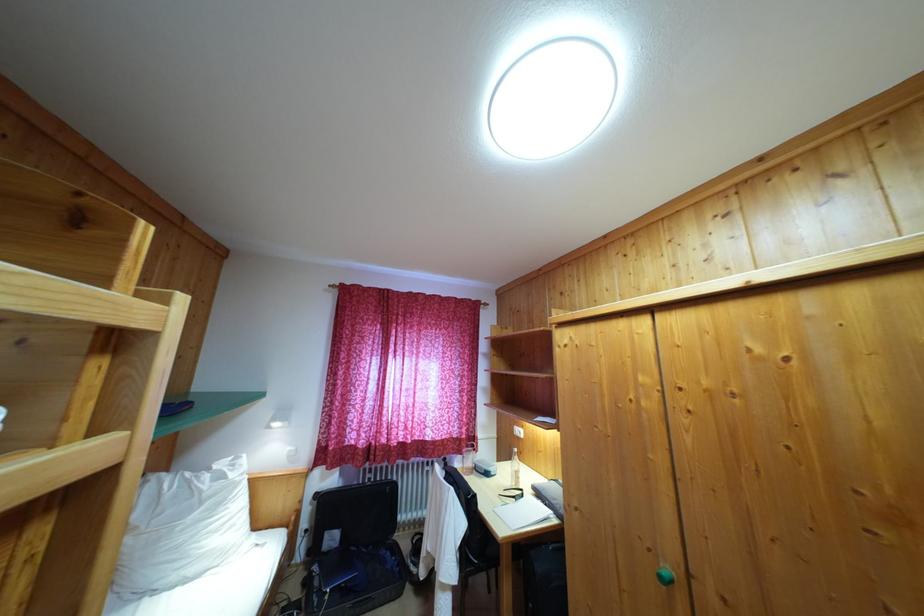
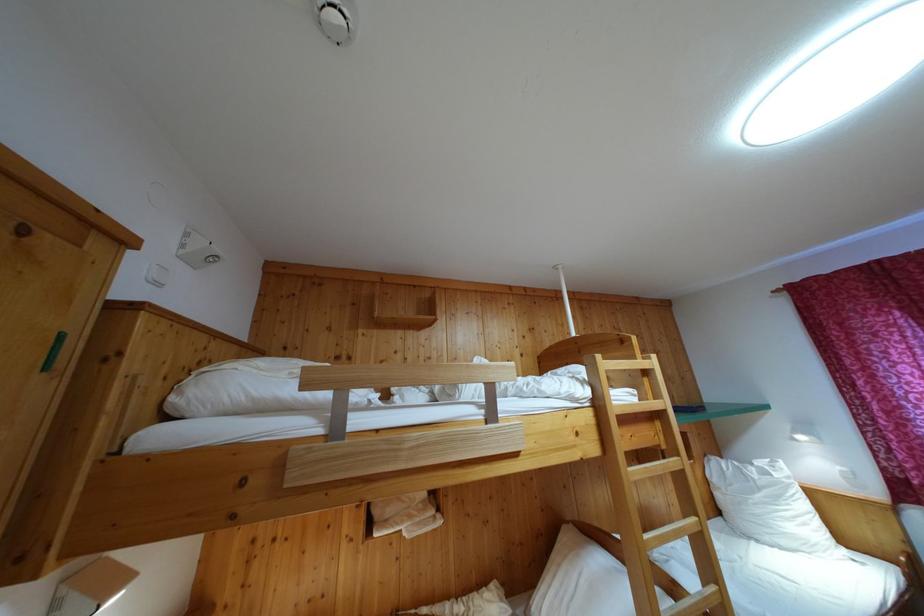
In the second image, find the point that corresponds to (213,476) in the first image.

(755, 471)